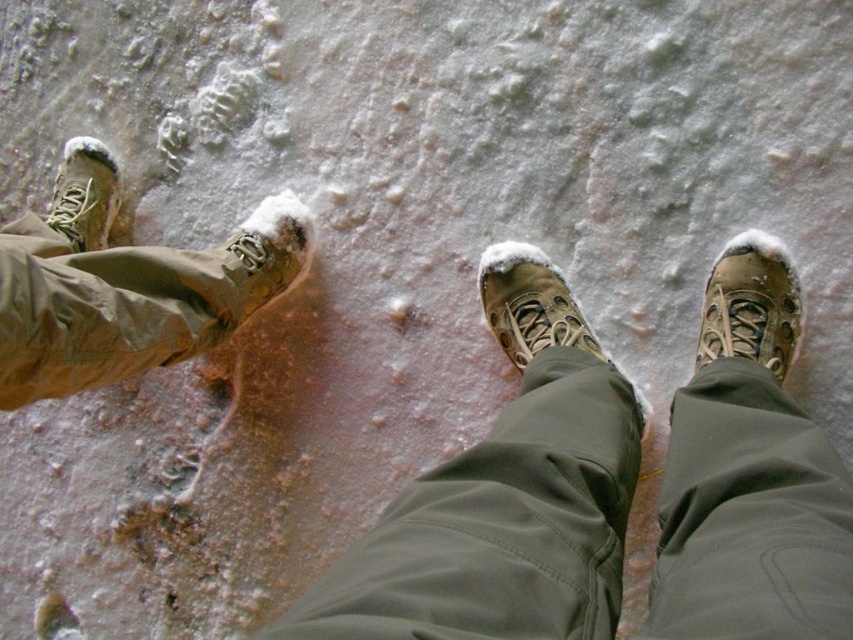
Is point (283, 260) closer to camera compared to point (511, 346)?

That is False.

Find the location of `matte brown hiking boot at left`. matte brown hiking boot at left is located at coordinates (125, 285).

Find the location of `matte brown hiking boot at left`. matte brown hiking boot at left is located at coordinates (125, 285).

Is point (505, 310) closer to viewer compared to point (241, 253)?

Yes, it is in front of point (241, 253).

Which is in front, point (518, 266) or point (288, 189)?

Point (518, 266)

Where is `brown suede boot at center`? The height and width of the screenshot is (640, 853). brown suede boot at center is located at coordinates (529, 304).

Is matte brown hiking boot at left thinner than matte brown boot at left?

Incorrect, matte brown hiking boot at left's width is not less than matte brown boot at left's.

Who is more distant from viewer, (x=251, y=244) or (x=76, y=156)?

Point (x=76, y=156)

This screenshot has width=853, height=640. What are the coordinates of `matte brown hiking boot at left` in the screenshot? It's located at (125, 285).